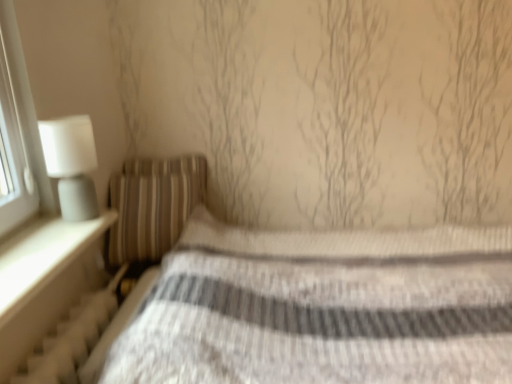
Question: Considering the relative sizes of white textured radiator at lower left and striped fabric bed at center in the image provided, is white textured radiator at lower left thinner than striped fabric bed at center?

Choices:
 (A) yes
 (B) no

Answer: (A)

Question: Can striped fabric bed at center be found inside white textured radiator at lower left?

Choices:
 (A) yes
 (B) no

Answer: (B)

Question: From a real-world perspective, does white textured radiator at lower left stand above striped fabric bed at center?

Choices:
 (A) yes
 (B) no

Answer: (A)

Question: Is white textured radiator at lower left far from striped fabric bed at center?

Choices:
 (A) no
 (B) yes

Answer: (A)

Question: Does white textured radiator at lower left have a smaller size compared to striped fabric bed at center?

Choices:
 (A) no
 (B) yes

Answer: (B)

Question: Does white textured radiator at lower left have a greater width compared to striped fabric bed at center?

Choices:
 (A) yes
 (B) no

Answer: (B)

Question: From the image's perspective, would you say white textured radiator at lower left is shown under white matte table lamp at left?

Choices:
 (A) no
 (B) yes

Answer: (B)

Question: Is white textured radiator at lower left at the right side of white matte table lamp at left?

Choices:
 (A) yes
 (B) no

Answer: (A)

Question: Is white textured radiator at lower left completely or partially outside of white matte table lamp at left?

Choices:
 (A) yes
 (B) no

Answer: (A)

Question: Can you confirm if white textured radiator at lower left is shorter than white matte table lamp at left?

Choices:
 (A) no
 (B) yes

Answer: (B)

Question: From a real-world perspective, is white textured radiator at lower left located higher than white matte table lamp at left?

Choices:
 (A) yes
 (B) no

Answer: (B)

Question: Is white textured radiator at lower left oriented away from white matte table lamp at left?

Choices:
 (A) no
 (B) yes

Answer: (A)

Question: Does white matte table lamp at left have a smaller size compared to striped fabric pillow at left?

Choices:
 (A) no
 (B) yes

Answer: (B)